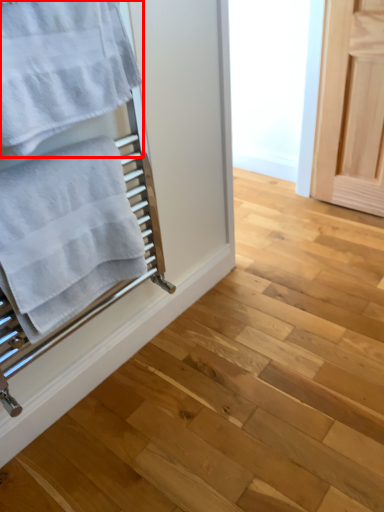
Question: In this image, where is towel (annotated by the red box) located relative to towel?

Choices:
 (A) left
 (B) right

Answer: (B)